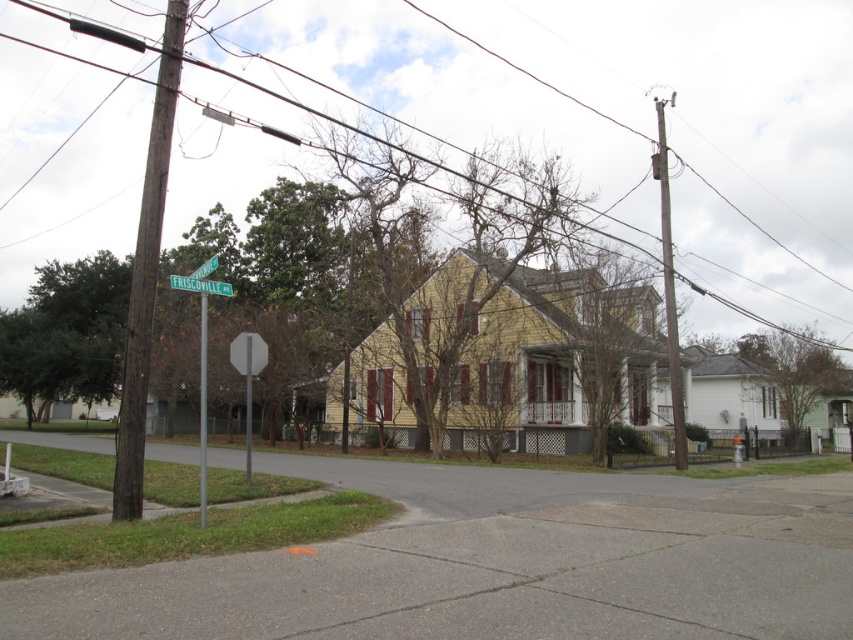
You are a city planner assessing the spacing between the brown wooden pole at left and the brown wooden utility pole at right. According to municipal regulations, utility poles must be spaced at least 20 meters apart. Is the current spacing compliant?

The distance between the brown wooden pole at left and the brown wooden utility pole at right is 25.08 meters, which exceeds the minimum requirement of 20 meters. Therefore, the spacing is compliant with municipal regulations.

You are a pedestrian standing at the street corner near the brown wooden pole at left and the brown wooden utility pole at right. Which pole is closer to you?

The brown wooden pole at left is closer to you because it is positioned under the brown wooden utility pole at right, indicating it is in front.